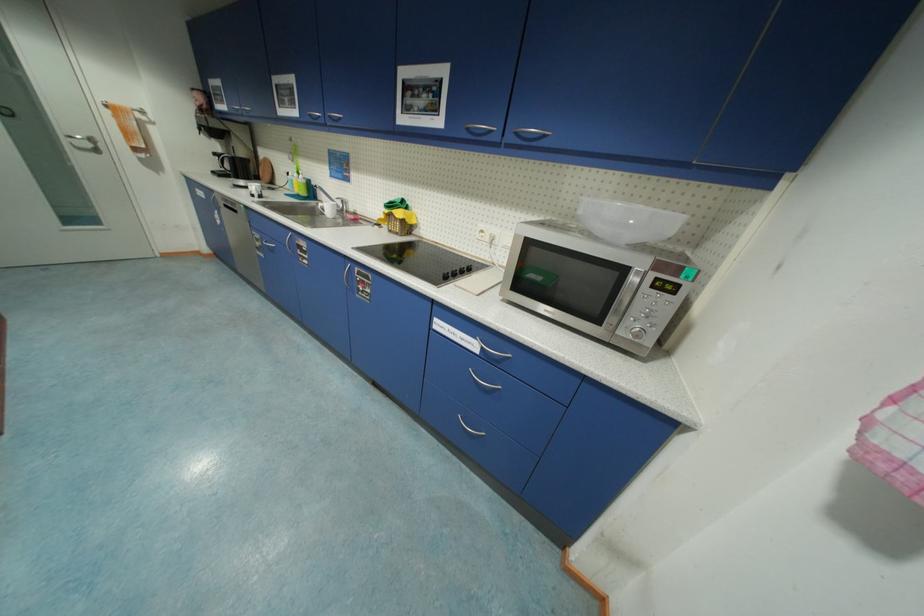
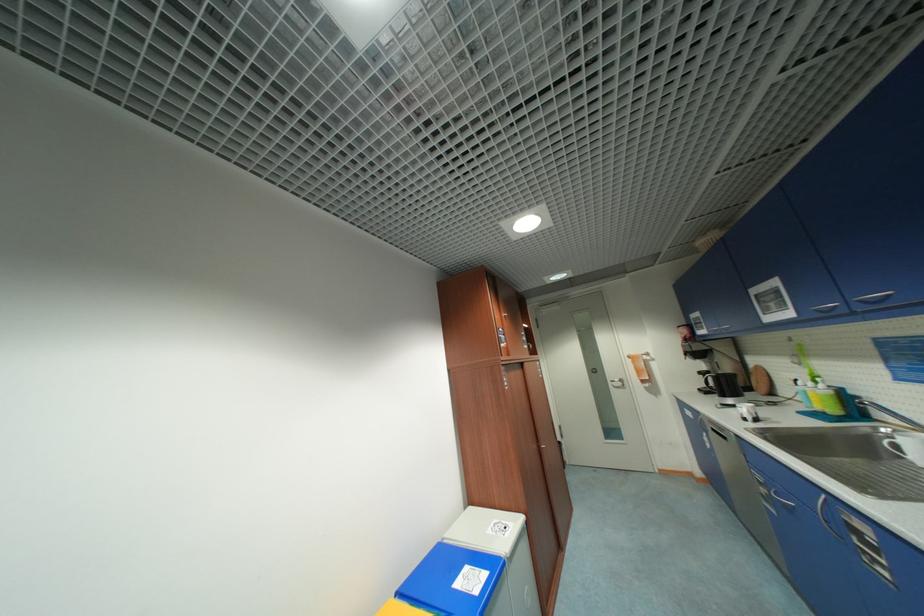
Locate, in the second image, the point that corresponds to (70,140) in the first image.

(615, 384)